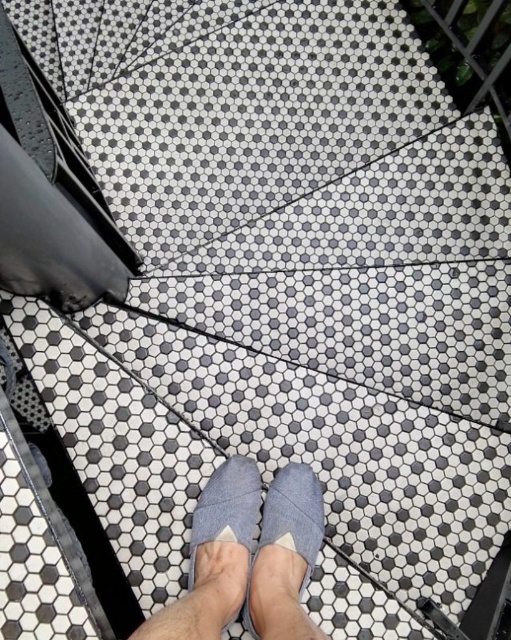
Does gray fabric slipper at center appear over gray fabric shoe at center?

No, gray fabric slipper at center is not above gray fabric shoe at center.

Between point (311, 536) and point (241, 528), which one is positioned in front?

Point (241, 528) is in front.

At what (x,y) coordinates should I click in order to perform the action: click on gray fabric slipper at center. Please return your answer as a coordinate pair (x, y). The height and width of the screenshot is (640, 511). Looking at the image, I should click on (286, 556).